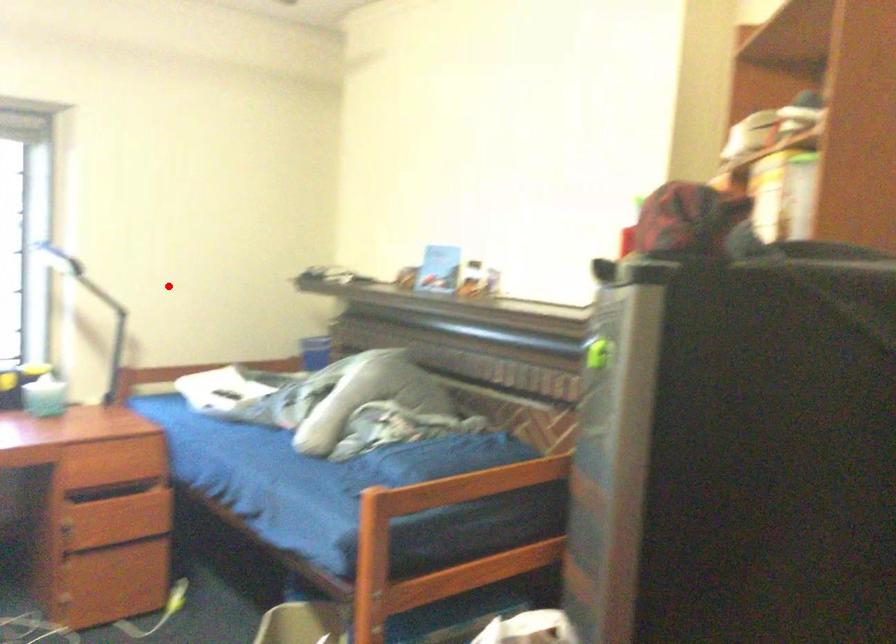
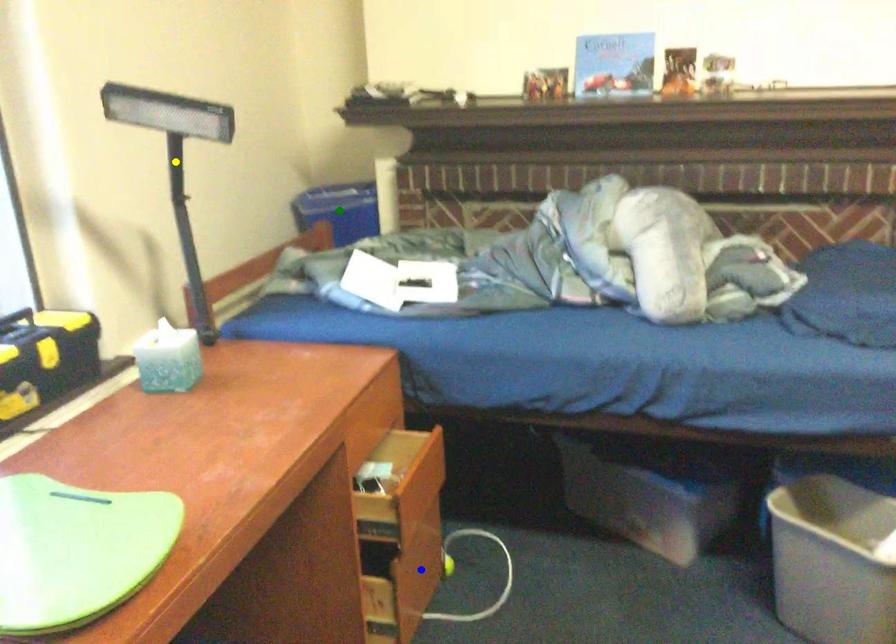
Question: I am providing you with two images of the same scene from different viewpoints. A red point is marked on the first image. You are given multiple points on the second image. Which point in image 2 is actually the same real-world point as the red point in image 1?

Choices:
 (A) blue point
 (B) yellow point
 (C) green point

Answer: (B)